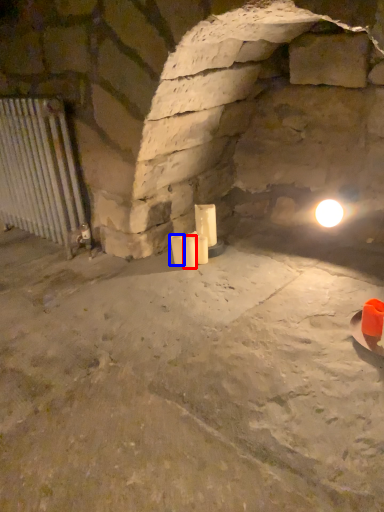
Question: Which object appears closest to the camera in this image, candle (highlighted by a red box) or candle (highlighted by a blue box)?

Choices:
 (A) candle
 (B) candle

Answer: (A)